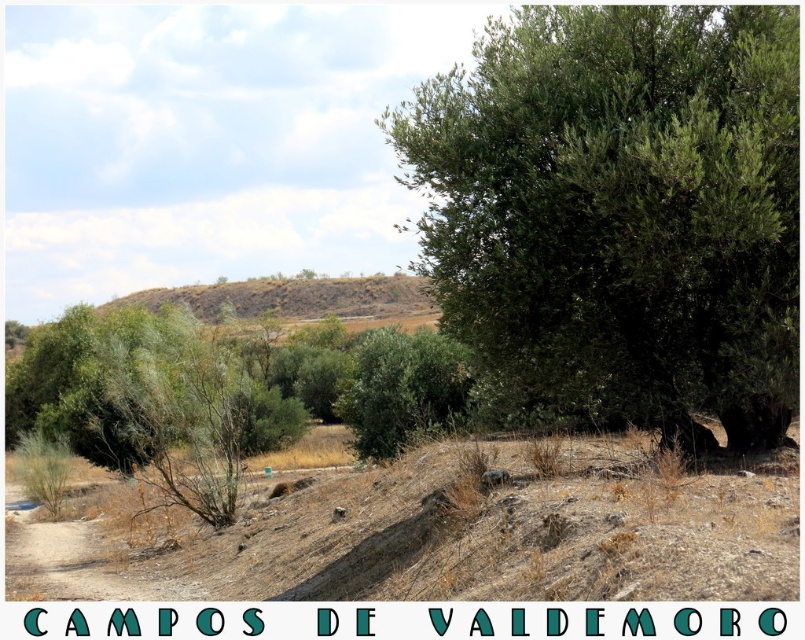
Question: Among these points, which one is nearest to the camera?

Choices:
 (A) (432, 545)
 (B) (620, 282)
 (C) (361, 291)

Answer: (A)

Question: From the image, what is the correct spatial relationship of brown dry soil at center in relation to brown/dry soil hill at upper center?

Choices:
 (A) left
 (B) right

Answer: (B)

Question: Does brown dry soil at center appear on the right side of brown/dry soil hill at upper center?

Choices:
 (A) no
 (B) yes

Answer: (B)

Question: Among these objects, which one is farthest from the camera?

Choices:
 (A) brown dry soil at center
 (B) brown/dry soil hill at upper center

Answer: (B)

Question: Which point appears farthest from the camera in this image?

Choices:
 (A) (122, 496)
 (B) (336, 294)
 (C) (502, 81)

Answer: (B)

Question: Does green leafy tree at upper right have a greater width compared to brown/dry soil hill at upper center?

Choices:
 (A) yes
 (B) no

Answer: (B)